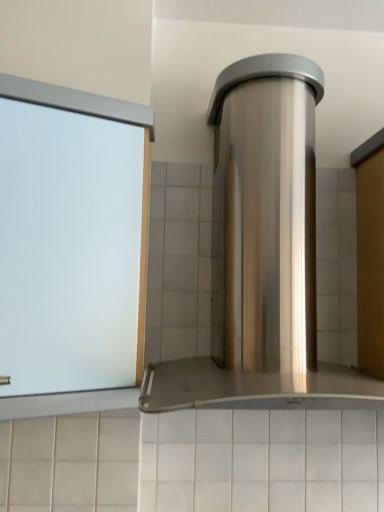
Question: Is there a large distance between frosted glass window at left and stainless steel range hood at center?

Choices:
 (A) yes
 (B) no

Answer: (B)

Question: Is frosted glass window at left touching stainless steel range hood at center?

Choices:
 (A) yes
 (B) no

Answer: (B)

Question: From the image's perspective, does frosted glass window at left appear lower than stainless steel range hood at center?

Choices:
 (A) no
 (B) yes

Answer: (B)

Question: Does frosted glass window at left appear on the right side of stainless steel range hood at center?

Choices:
 (A) yes
 (B) no

Answer: (B)

Question: From a real-world perspective, is frosted glass window at left physically above stainless steel range hood at center?

Choices:
 (A) yes
 (B) no

Answer: (B)

Question: Would you say frosted glass window at left is outside stainless steel range hood at center?

Choices:
 (A) yes
 (B) no

Answer: (A)

Question: Is the depth of stainless steel range hood at center less than that of frosted glass window at left?

Choices:
 (A) no
 (B) yes

Answer: (B)

Question: Can you confirm if stainless steel range hood at center is smaller than frosted glass window at left?

Choices:
 (A) no
 (B) yes

Answer: (A)

Question: Does stainless steel range hood at center have a larger size compared to frosted glass window at left?

Choices:
 (A) yes
 (B) no

Answer: (A)

Question: Is stainless steel range hood at center thinner than frosted glass window at left?

Choices:
 (A) no
 (B) yes

Answer: (A)

Question: Does stainless steel range hood at center have a greater width compared to frosted glass window at left?

Choices:
 (A) yes
 (B) no

Answer: (A)

Question: Is stainless steel range hood at center taller than frosted glass window at left?

Choices:
 (A) no
 (B) yes

Answer: (B)

Question: Considering the positions of stainless steel range hood at center and frosted glass window at left in the image, is stainless steel range hood at center taller or shorter than frosted glass window at left?

Choices:
 (A) tall
 (B) short

Answer: (A)